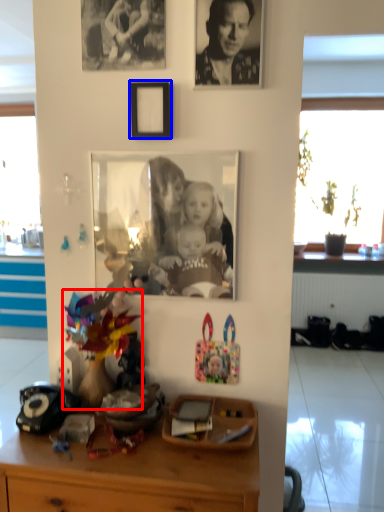
Question: Among these objects, which one is nearest to the camera, toy (highlighted by a red box) or picture frame (highlighted by a blue box)?

Choices:
 (A) toy
 (B) picture frame

Answer: (A)